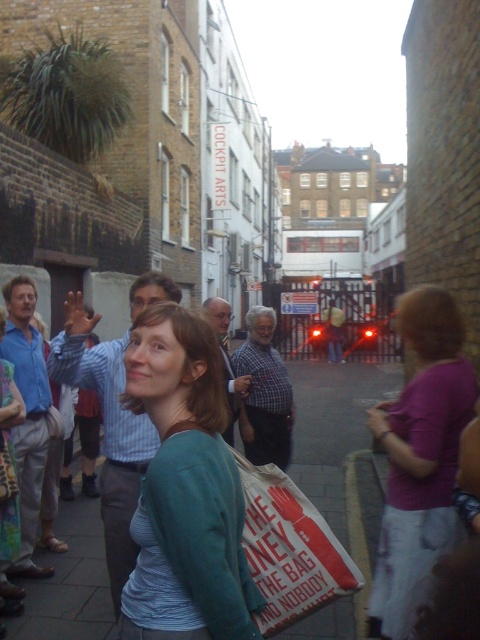
Does purple fabric shirt at right appear under green fabric jacket at center?

Actually, purple fabric shirt at right is above green fabric jacket at center.

Is purple fabric shirt at right thinner than green fabric jacket at center?

Incorrect, purple fabric shirt at right's width is not less than green fabric jacket at center's.

The image size is (480, 640). What do you see at coordinates (420, 458) in the screenshot?
I see `purple fabric shirt at right` at bounding box center [420, 458].

This screenshot has width=480, height=640. I want to click on purple fabric shirt at right, so click(420, 458).

Can you confirm if purple fabric shirt at right is smaller than white paper bag at center?

No.

Does purple fabric shirt at right have a greater width compared to white paper bag at center?

In fact, purple fabric shirt at right might be narrower than white paper bag at center.

This screenshot has width=480, height=640. In order to click on purple fabric shirt at right in this screenshot , I will do `click(420, 458)`.

Does point (230, 504) come behind point (261, 483)?

No, (230, 504) is in front of (261, 483).

Is matte green sweater at center to the right of white paper bag at center from the viewer's perspective?

Incorrect, matte green sweater at center is not on the right side of white paper bag at center.

Who is more distant from viewer, (203,492) or (277,504)?

The point (277,504) is behind.

Where is `matte green sweater at center`? The width and height of the screenshot is (480, 640). matte green sweater at center is located at coordinates (184, 490).